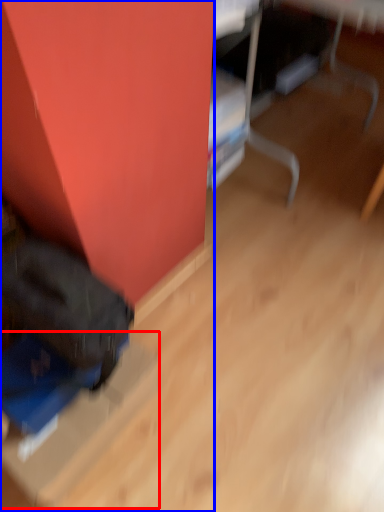
Question: Which object is further to the camera taking this photo, cardboard box (highlighted by a red box) or furniture (highlighted by a blue box)?

Choices:
 (A) cardboard box
 (B) furniture

Answer: (A)